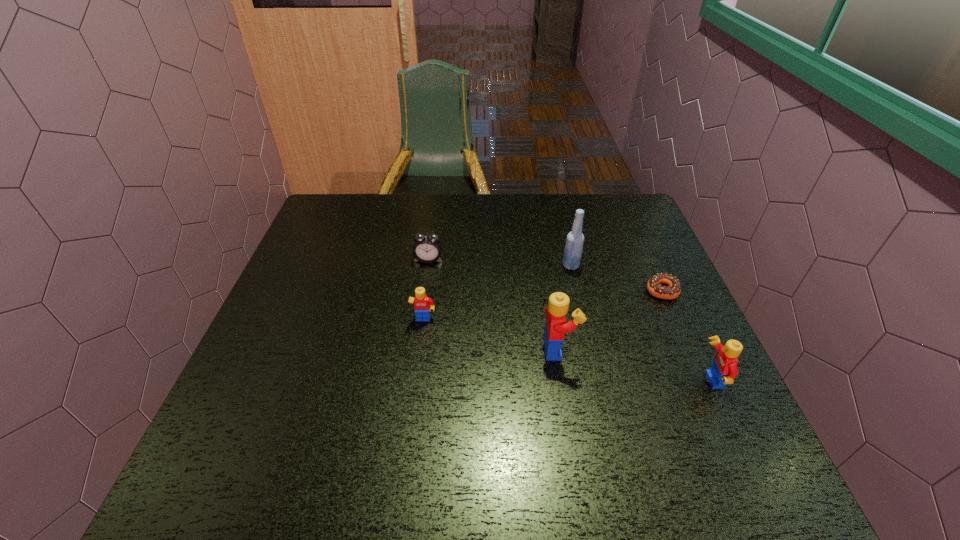
You are a GUI agent. You are given a task and a screenshot of the screen. Output one action in this format:
    pyautogui.click(x=<x>, y=<y>)
    Task: Click on the free space located on the face of the farthest Lego
    The width and height of the screenshot is (960, 540).
    Given the screenshot: What is the action you would take?
    pyautogui.click(x=410, y=427)

Locate an element on the screen. vacant space located on the face of the tallest Lego is located at coordinates (643, 349).

The height and width of the screenshot is (540, 960). In order to click on vacant space located on the face of the nearest Lego in this screenshot , I will do `click(660, 381)`.

I want to click on vacant point located on the face of the nearest Lego, so coord(670,381).

This screenshot has height=540, width=960. What are the coordinates of `vacant space located on the face of the nearest Lego` in the screenshot? It's located at (670, 381).

The image size is (960, 540). Identify the location of free spot located on the right of the bottle. (636, 266).

At what (x,y) coordinates should I click in order to perform the action: click on free spot located on the front side of the alarm clock. Please return your answer as a coordinate pair (x, y). Image resolution: width=960 pixels, height=540 pixels. Looking at the image, I should click on pos(411,388).

Locate an element on the screen. vacant area situated 0.270m on the left of the fourth nearest object is located at coordinates click(542, 290).

At what (x,y) coordinates should I click in order to perform the action: click on Lego that is at the right edge. Please return your answer as a coordinate pair (x, y). The height and width of the screenshot is (540, 960). Looking at the image, I should click on (724, 369).

Locate an element on the screen. doughnut present at the right edge is located at coordinates point(673,290).